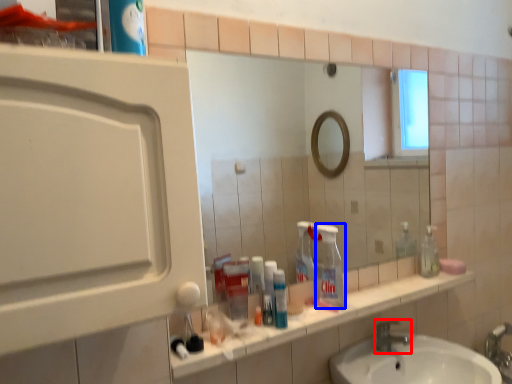
Question: Which point is further to the camera, tap (highlighted by a red box) or cleaning product (highlighted by a blue box)?

Choices:
 (A) tap
 (B) cleaning product

Answer: (A)